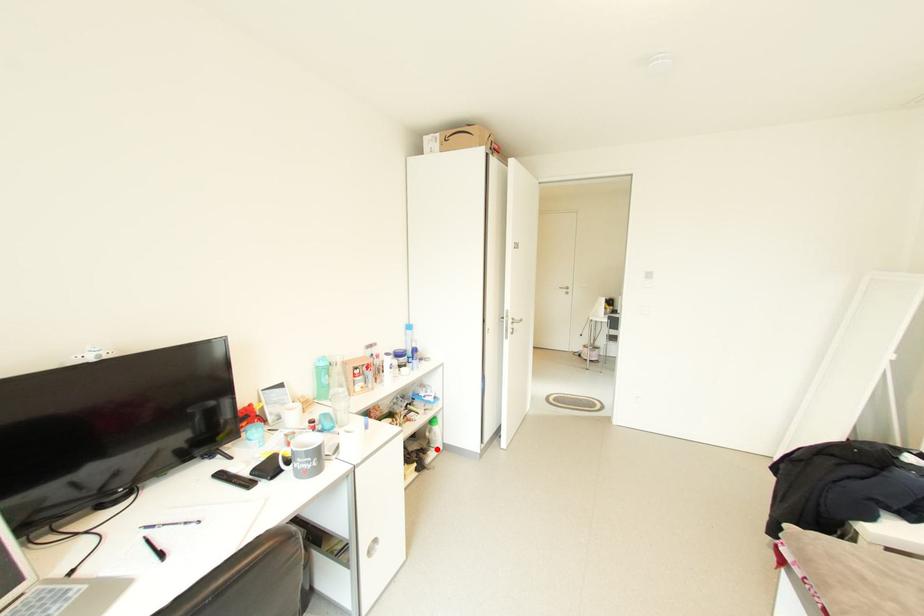
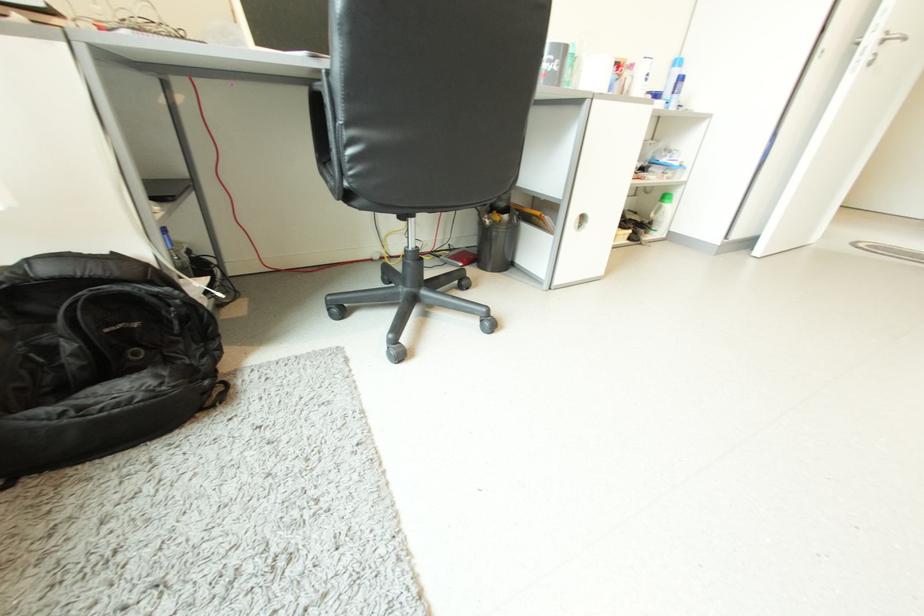
The point at the highlighted location is marked in the first image. Where is the corresponding point in the second image?

(657, 232)